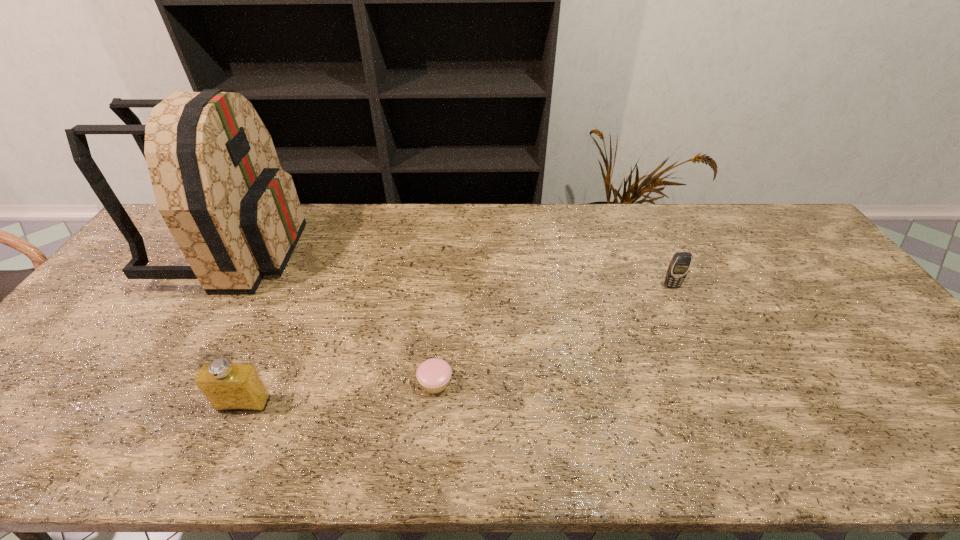
This screenshot has width=960, height=540. Find the location of `vacant area between the third shortest object and the second shortest object`. vacant area between the third shortest object and the second shortest object is located at coordinates (458, 345).

The width and height of the screenshot is (960, 540). I want to click on vacant region between the cellular telephone and the backpack, so click(453, 268).

In order to click on vacant space that is in between the backpack and the cupcake in this screenshot , I will do click(335, 316).

You are a GUI agent. You are given a task and a screenshot of the screen. Output one action in this format:
    pyautogui.click(x=<x>, y=<y>)
    Task: Click on the free area in between the second tallest object and the third object from left to right
    
    Given the screenshot: What is the action you would take?
    pyautogui.click(x=339, y=393)

Identify the location of vacant area that lies between the second shortest object and the tallest object. The height and width of the screenshot is (540, 960). (453, 268).

I want to click on unoccupied position between the rightmost object and the tallest object, so click(453, 268).

The height and width of the screenshot is (540, 960). In order to click on free spot between the backpack and the shortest object in this screenshot , I will do `click(335, 316)`.

Identify the location of free space between the cellular telephone and the tallest object. (453, 268).

Choose which object is the nearest neighbor to the cellular telephone. Please provide its 2D coordinates. Your answer should be formatted as a tuple, i.e. [(x, y)], where the tuple contains the x and y coordinates of a point satisfying the conditions above.

[(433, 374)]

At what (x,y) coordinates should I click in order to perform the action: click on object that is the third closest to the shortest object. Please return your answer as a coordinate pair (x, y). The image size is (960, 540). Looking at the image, I should click on (679, 266).